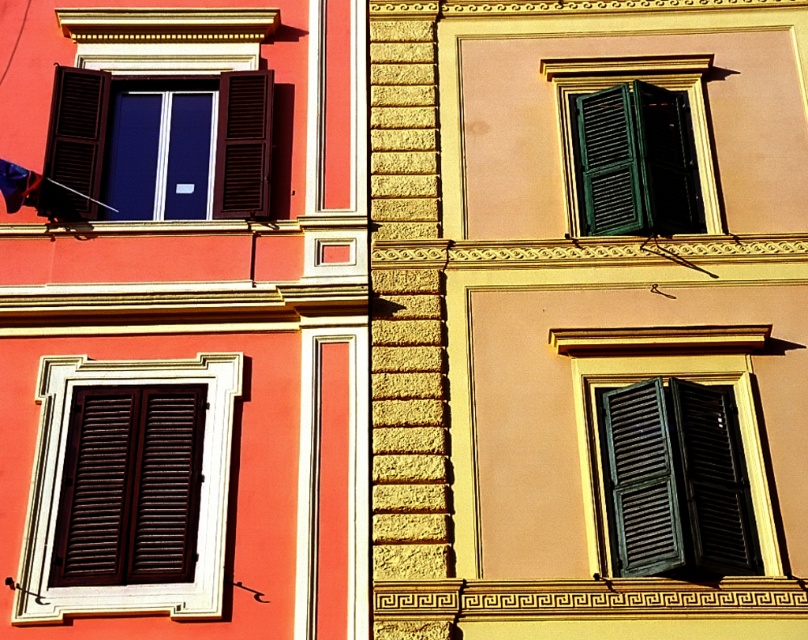
You are a GUI agent. You are given a task and a screenshot of the screen. Output one action in this format:
    pyautogui.click(x=<x>, y=<y>)
    Task: Click on the matte black shutters at upper left
    
    Given the screenshot: What is the action you would take?
    pyautogui.click(x=158, y=147)

Who is more distant from viewer, [267,88] or [24,202]?

The point [267,88] is behind.

This screenshot has height=640, width=808. I want to click on matte black shutters at upper left, so click(x=158, y=147).

Is matte black shutters at upper left thinner than green matte shutters at upper right?

In fact, matte black shutters at upper left might be wider than green matte shutters at upper right.

Between point (202, 99) and point (712, 198), which one is positioned in front?

Point (712, 198) is more forward.

Who is more forward, [163,93] or [583,76]?

Positioned in front is point [583,76].

Find the location of a particular element. This screenshot has height=640, width=808. matte black shutters at upper left is located at coordinates (158, 147).

Which is in front, point (59, 216) or point (104, 88)?

Point (59, 216) is in front.

Is matte black shutters at upper left wider than matte brown shutter at upper left?

Yes, matte black shutters at upper left is wider than matte brown shutter at upper left.

The height and width of the screenshot is (640, 808). I want to click on matte black shutters at upper left, so click(158, 147).